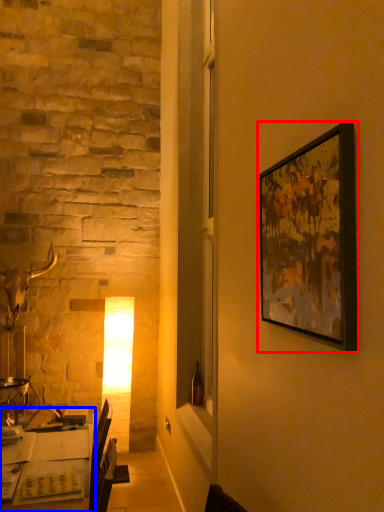
Question: Which point is closer to the camera, picture frame (highlighted by a red box) or table (highlighted by a blue box)?

Choices:
 (A) picture frame
 (B) table

Answer: (A)